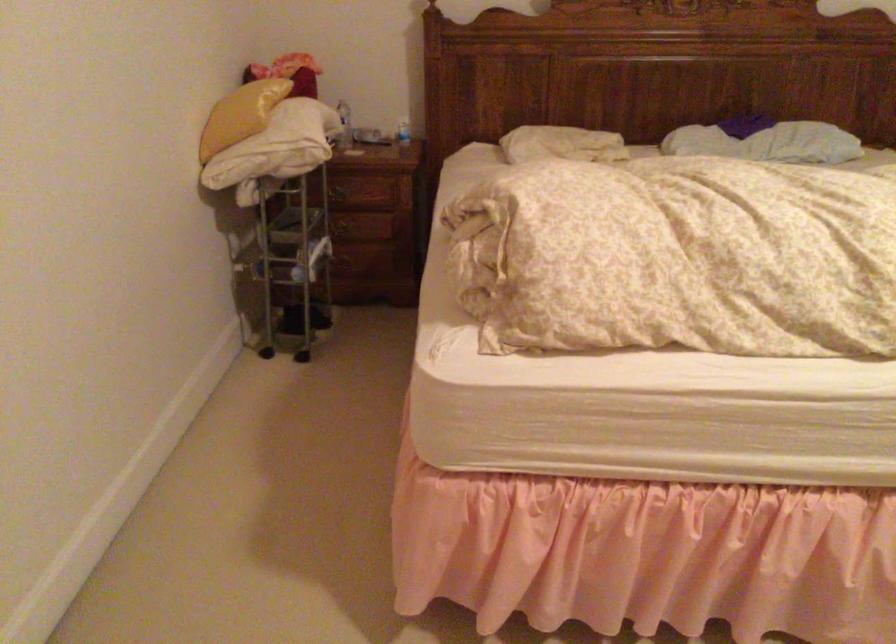
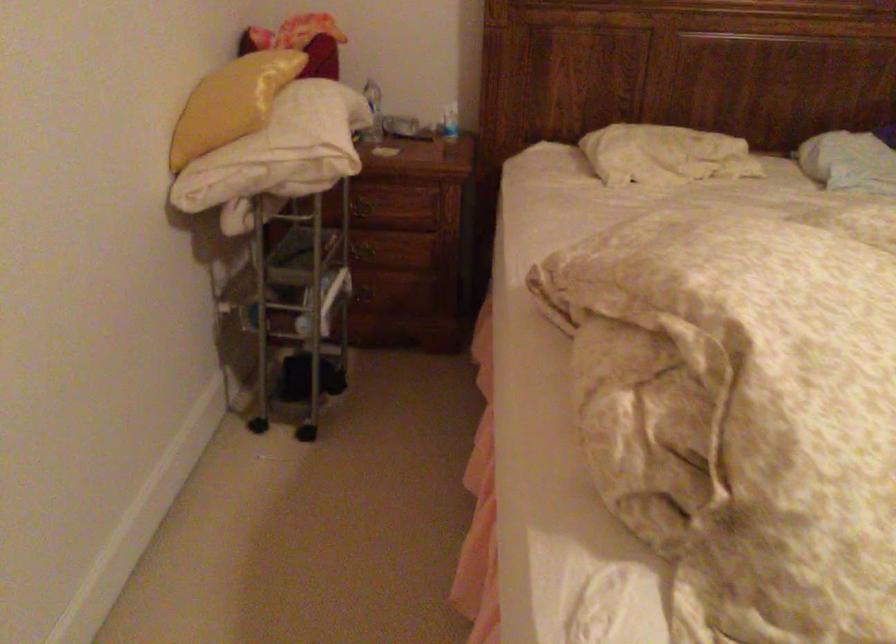
Question: Based on the continuous images, in which direction is the camera rotating? Reply with the corresponding letter.

Choices:
 (A) Left
 (B) Right
 (C) Up
 (D) Down

Answer: (D)